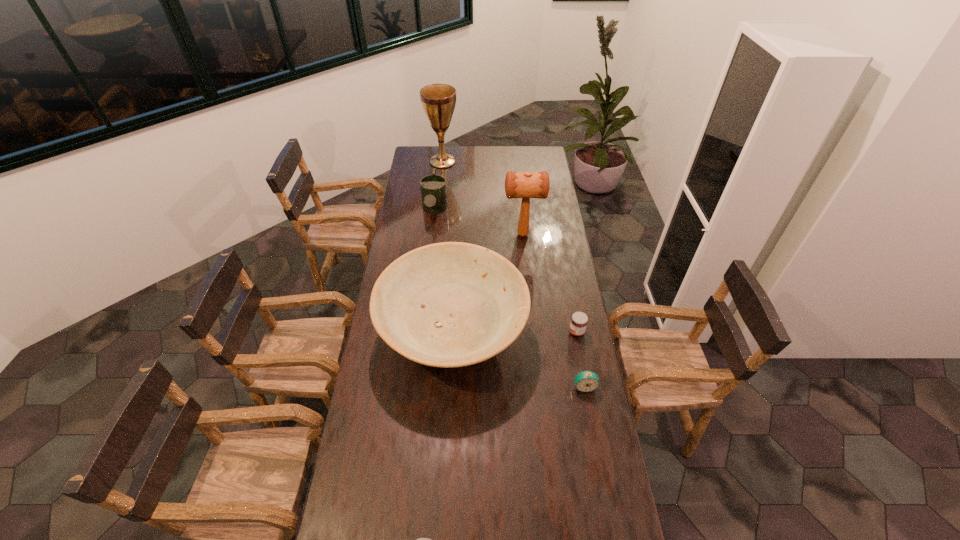
Where is `the farthest object`? Image resolution: width=960 pixels, height=540 pixels. the farthest object is located at coordinates (438, 100).

You are a GUI agent. You are given a task and a screenshot of the screen. Output one action in this format:
    pyautogui.click(x=<x>, y=<y>)
    Task: Click on the tallest object
    The width and height of the screenshot is (960, 540).
    Given the screenshot: What is the action you would take?
    pyautogui.click(x=438, y=100)

Where is `mallet`? Image resolution: width=960 pixels, height=540 pixels. mallet is located at coordinates (525, 185).

What are the coordinates of `dish` in the screenshot? It's located at (452, 304).

Find the location of a particular element. This screenshot has height=540, width=960. the fourth tallest object is located at coordinates (433, 187).

This screenshot has width=960, height=540. In order to click on alarm clock in this screenshot , I will do `click(586, 381)`.

Identify the location of jam. This screenshot has height=540, width=960. (579, 320).

Locate an element on the screen. The width and height of the screenshot is (960, 540). vacant area situated on the right of the farthest object is located at coordinates (522, 161).

Identify the location of vacant space located 0.160m on the strike surface of the second tallest object. The image size is (960, 540). (471, 235).

The width and height of the screenshot is (960, 540). In order to click on vacant space located on the strike surface of the second tallest object in this screenshot , I will do `click(461, 235)`.